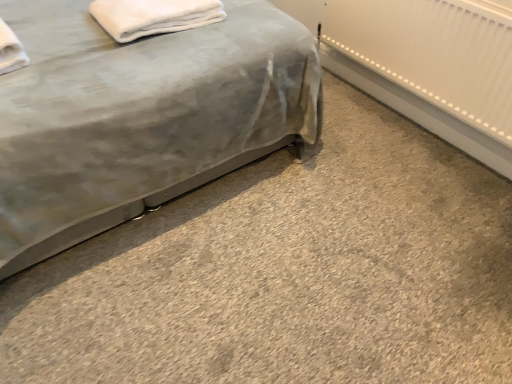
Question: Is velvet gray bed at lower left to the left or to the right of white fluffy towel at upper left in the image?

Choices:
 (A) right
 (B) left

Answer: (B)

Question: From the image's perspective, is velvet gray bed at lower left above or below white fluffy towel at upper left?

Choices:
 (A) above
 (B) below

Answer: (A)

Question: In terms of height, does velvet gray bed at lower left look taller or shorter compared to white fluffy towel at upper left?

Choices:
 (A) tall
 (B) short

Answer: (A)

Question: Considering the positions of white fluffy towel at upper left and velvet gray bed at lower left in the image, is white fluffy towel at upper left taller or shorter than velvet gray bed at lower left?

Choices:
 (A) tall
 (B) short

Answer: (B)

Question: Is white fluffy towel at upper left in front of or behind velvet gray bed at lower left in the image?

Choices:
 (A) behind
 (B) front

Answer: (A)

Question: Considering the positions of white fluffy towel at upper left and velvet gray bed at lower left in the image, is white fluffy towel at upper left bigger or smaller than velvet gray bed at lower left?

Choices:
 (A) small
 (B) big

Answer: (A)

Question: From the image's perspective, is white fluffy towel at upper left located above or below velvet gray bed at lower left?

Choices:
 (A) above
 (B) below

Answer: (B)